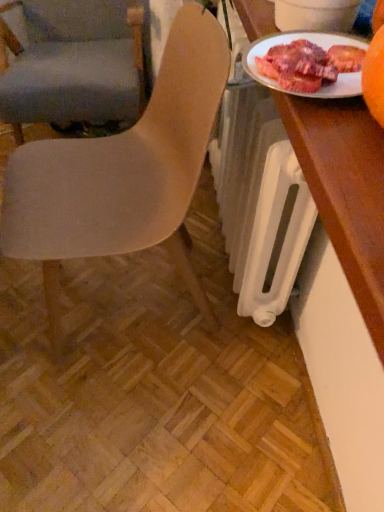
Question: Considering the relative positions of matte beige chair at center, which is the first chair in front-to-back order, and wooden desk at right in the image provided, is matte beige chair at center, which is the first chair in front-to-back order, to the right of wooden desk at right from the viewer's perspective?

Choices:
 (A) yes
 (B) no

Answer: (B)

Question: Is matte beige chair at center, which is the first chair in front-to-back order, outside of wooden desk at right?

Choices:
 (A) yes
 (B) no

Answer: (A)

Question: From the image's perspective, does matte beige chair at center, which is the first chair in front-to-back order, appear higher than wooden desk at right?

Choices:
 (A) no
 (B) yes

Answer: (A)

Question: Is matte beige chair at center, which is the first chair in front-to-back order, surrounding wooden desk at right?

Choices:
 (A) no
 (B) yes

Answer: (A)

Question: From a real-world perspective, is matte beige chair at center, the 2th chair when ordered from back to front, on top of wooden desk at right?

Choices:
 (A) no
 (B) yes

Answer: (A)

Question: Would you say matte beige chair at center, the 2th chair when ordered from back to front, is to the left or to the right of matte gray chair at left, the second chair from the front, in the picture?

Choices:
 (A) left
 (B) right

Answer: (B)

Question: Do you think matte beige chair at center, which is the first chair in front-to-back order, is within matte gray chair at left, the second chair from the front, or outside of it?

Choices:
 (A) outside
 (B) inside

Answer: (A)

Question: In terms of width, does matte beige chair at center, the 2th chair when ordered from back to front, look wider or thinner when compared to matte gray chair at left, the second chair from the front?

Choices:
 (A) wide
 (B) thin

Answer: (B)

Question: From a real-world perspective, relative to matte gray chair at left, the second chair from the front, is matte beige chair at center, which is the first chair in front-to-back order, vertically above or below?

Choices:
 (A) below
 (B) above

Answer: (B)

Question: In terms of size, does matte beige chair at center, the 2th chair when ordered from back to front, appear bigger or smaller than wooden desk at right?

Choices:
 (A) big
 (B) small

Answer: (A)

Question: Is matte beige chair at center, the 2th chair when ordered from back to front, taller or shorter than wooden desk at right?

Choices:
 (A) tall
 (B) short

Answer: (A)

Question: Is point (26, 204) positioned closer to the camera than point (284, 117)?

Choices:
 (A) farther
 (B) closer

Answer: (A)

Question: From the image's perspective, is matte beige chair at center, which is the first chair in front-to-back order, above or below wooden desk at right?

Choices:
 (A) below
 (B) above

Answer: (A)

Question: Considering their positions, is wooden desk at right located in front of or behind matte gray chair at left, the second chair from the front?

Choices:
 (A) front
 (B) behind

Answer: (A)

Question: Based on their sizes in the image, would you say wooden desk at right is bigger or smaller than matte gray chair at left, the second chair from the front?

Choices:
 (A) big
 (B) small

Answer: (B)